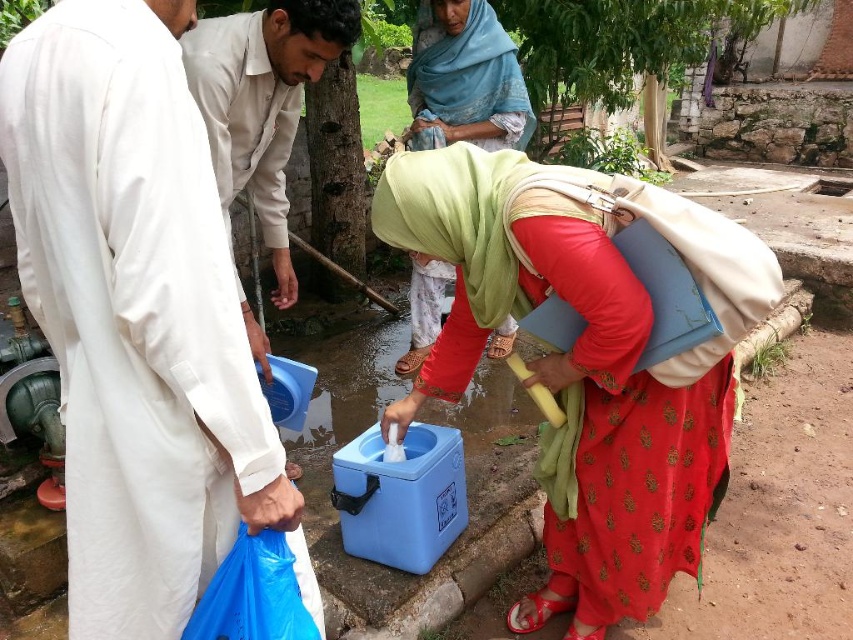
Question: Is white matte robe at left to the right of matte green scarf at center from the viewer's perspective?

Choices:
 (A) no
 (B) yes

Answer: (A)

Question: Is white matte robe at left bigger than matte blue cooler at center?

Choices:
 (A) yes
 (B) no

Answer: (B)

Question: Considering the real-world distances, which object is farthest from the white matte robe at left?

Choices:
 (A) beige cotton shirt at left
 (B) matte green scarf at center
 (C) matte blue cooler at center

Answer: (B)

Question: Considering the real-world distances, which object is farthest from the white matte robe at left?

Choices:
 (A) matte green scarf at center
 (B) beige cotton shirt at left
 (C) matte blue cooler at center

Answer: (A)

Question: From the image, what is the correct spatial relationship of matte blue cooler at center in relation to beige cotton shirt at left?

Choices:
 (A) right
 (B) left

Answer: (A)

Question: Which object appears closest to the camera in this image?

Choices:
 (A) matte green scarf at center
 (B) matte blue cooler at center
 (C) white matte robe at left

Answer: (C)